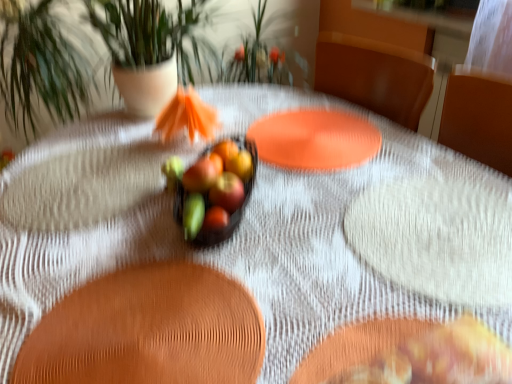
Where is `green leafy plant at center`? green leafy plant at center is located at coordinates (39, 67).

This screenshot has width=512, height=384. Identify the location of golden-brown crispy pastry at lower right. point(439,358).

Locate an element on the screen. green matte apple at center, placed as the 2th fruit when sorted from bottom to top is located at coordinates (173, 172).

Measure the distance between green matte flower at center and camera.

green matte flower at center is 86.08 centimeters away from camera.

Where is `green leafy plant at center`? The image size is (512, 384). green leafy plant at center is located at coordinates (39, 67).

Which object is closer to the camera taking this photo, glossy ceramic grapefruit at center or glossy apple at center, arranged as the first apple when viewed from the back?

Positioned in front is glossy ceramic grapefruit at center.

Which object is wider, glossy ceramic grapefruit at center or glossy apple at center, arranged as the first apple when viewed from the back?

With larger width is glossy ceramic grapefruit at center.

From the image's perspective, which is above, glossy ceramic grapefruit at center or glossy apple at center, arranged as the first apple when viewed from the back?

glossy apple at center, arranged as the first apple when viewed from the back.

Who is bigger, glossy glass bowl at center, which ranks as the third fruit in left-to-right order, or green matte apple at center, the third fruit positioned from the right?

With larger size is glossy glass bowl at center, which ranks as the third fruit in left-to-right order.

Based on the photo, based on their positions, is glossy glass bowl at center, the 3th fruit when ordered from bottom to top, located to the left or right of green matte apple at center, the 2th fruit from the front?

glossy glass bowl at center, the 3th fruit when ordered from bottom to top, is positioned on green matte apple at center, the 2th fruit from the front,'s right side.

From the image's perspective, which object appears higher, glossy glass bowl at center, which ranks as the third fruit in left-to-right order, or green matte apple at center, the third fruit positioned from the right?

glossy glass bowl at center, which ranks as the third fruit in left-to-right order, appears higher in the image.

Find the location of a particular element. fruit that is the 2nd one when counting rightward from the green matte apple at center, placed as the 2th fruit when sorted from bottom to top is located at coordinates (226, 149).

Could you tell me if green matte apple at center, the third fruit positioned from the right, is turned towards glossy apple at center, arranged as the first apple when viewed from the back?

No, green matte apple at center, the third fruit positioned from the right, does not turn towards glossy apple at center, arranged as the first apple when viewed from the back.

Could glossy apple at center, arranged as the second apple when viewed from the front, be considered to be inside green matte apple at center, the third fruit positioned from the right?

No, glossy apple at center, arranged as the second apple when viewed from the front, is located outside of green matte apple at center, the third fruit positioned from the right.

In terms of height, does green matte apple at center, the 1th fruit when ordered from left to right, look taller or shorter compared to glossy apple at center, arranged as the second apple when viewed from the front?

In the image, green matte apple at center, the 1th fruit when ordered from left to right, appears to be shorter than glossy apple at center, arranged as the second apple when viewed from the front.

Relative to glossy apple at center, arranged as the first apple when viewed from the back, is green matte apple at center, which is the second fruit in back-to-front order, in front or behind?

green matte apple at center, which is the second fruit in back-to-front order, is positioned farther from the viewer than glossy apple at center, arranged as the first apple when viewed from the back.

Could green matte flower at center be considered to be inside glossy glass bowl at center, the first fruit from the top?

Actually, green matte flower at center is outside glossy glass bowl at center, the first fruit from the top.

Where is `flower that is below the glossy glass bowl at center, which ranks as the third fruit in left-to-right order (from the image's perspective)`? This screenshot has height=384, width=512. flower that is below the glossy glass bowl at center, which ranks as the third fruit in left-to-right order (from the image's perspective) is located at coordinates (200, 176).

From the image's perspective, is glossy glass bowl at center, the third fruit from the front, on green matte flower at center?

Yes, from the image's perspective, glossy glass bowl at center, the third fruit from the front, is above green matte flower at center.

Does golden-brown crispy pastry at lower right have a lesser width compared to green matte apple at center, acting as the 2th fruit starting from the top?

No.

Does point (456, 349) come in front of point (178, 172)?

Yes.

Does golden-brown crispy pastry at lower right have a smaller size compared to green matte apple at center, the 2th fruit from the front?

No.

From a real-world perspective, starting from the golden-brown crispy pastry at lower right, which fruit is the 2nd one vertically above it? Please provide its 2D coordinates.

[(173, 172)]

Does point (169, 173) come farther from viewer compared to point (206, 233)?

Yes, point (169, 173) is farther from viewer.

Is green matte apple at center, the 1th fruit when ordered from left to right, to the right of glossy ceramic grapefruit at center from the viewer's perspective?

No, green matte apple at center, the 1th fruit when ordered from left to right, is not to the right of glossy ceramic grapefruit at center.

Is glossy ceramic grapefruit at center a part of green matte apple at center, which is the second fruit in back-to-front order?

No, glossy ceramic grapefruit at center is not a part of green matte apple at center, which is the second fruit in back-to-front order.

In the scene shown: Can you confirm if green matte apple at center, the 2th fruit from the front, is taller than glossy ceramic grapefruit at center?

Indeed, green matte apple at center, the 2th fruit from the front, has a greater height compared to glossy ceramic grapefruit at center.

Is glossy ceramic grapefruit at center positioned far away from green matte flower at center?

No, glossy ceramic grapefruit at center is not far from green matte flower at center.

Could you tell me if glossy ceramic grapefruit at center is facing green matte flower at center?

No, glossy ceramic grapefruit at center is not turned towards green matte flower at center.

Can you confirm if glossy ceramic grapefruit at center is positioned to the right of green matte flower at center?

Correct, you'll find glossy ceramic grapefruit at center to the right of green matte flower at center.

Which is farther, [181,210] or [201,170]?

Point [201,170]

The height and width of the screenshot is (384, 512). Find the location of `grapefruit directly beneath the glossy apple at center, arranged as the second apple when viewed from the front (from a real-world perspective)`. grapefruit directly beneath the glossy apple at center, arranged as the second apple when viewed from the front (from a real-world perspective) is located at coordinates tap(239, 208).

Image resolution: width=512 pixels, height=384 pixels. I want to click on the 2nd fruit counting from the left of the glossy glass bowl at center, the first fruit from the top, so click(x=173, y=172).

In the scene shown: Estimate the real-world distances between objects in this image. Which object is further from green matte apple at center, which is the second fruit in back-to-front order, glossy apple at center, arranged as the first apple when viewed from the back, or golden-brown crispy pastry at lower right?

golden-brown crispy pastry at lower right.

Estimate the real-world distances between objects in this image. Which object is closer to green matte flower at center, glossy glass bowl at center, the third fruit from the front, or golden-brown crispy pastry at lower right?

Based on the image, glossy glass bowl at center, the third fruit from the front, appears to be nearer to green matte flower at center.

Looking at the image, which one is located further to green leafy plant at center, glossy apple at center, arranged as the first apple when viewed from the back, or glossy ceramic grapefruit at center?

glossy apple at center, arranged as the first apple when viewed from the back, is positioned further to the anchor green leafy plant at center.

Which object lies nearer to the anchor point glossy red apple at center, the second apple in the back-to-front sequence, green matte flower at center or glossy ceramic grapefruit at center?

green matte flower at center is positioned closer to the anchor glossy red apple at center, the second apple in the back-to-front sequence.

From the image, which object appears to be farther from glossy apple at center, arranged as the second apple when viewed from the front, glossy red apple at center, placed as the third fruit when sorted from back to front, or glossy red apple at center, the second apple in the back-to-front sequence?

glossy red apple at center, placed as the third fruit when sorted from back to front, is positioned further to the anchor glossy apple at center, arranged as the second apple when viewed from the front.

Considering their positions, is glossy ceramic grapefruit at center positioned closer to glossy apple at center, arranged as the first apple when viewed from the back, than glossy red apple at center, the first apple in the front-to-back sequence?

glossy red apple at center, the first apple in the front-to-back sequence, lies closer to glossy apple at center, arranged as the first apple when viewed from the back, than the other object.

From the image, which object appears to be nearer to golden-brown crispy pastry at lower right, glossy red apple at center, the first apple in the front-to-back sequence, or glossy apple at center, arranged as the second apple when viewed from the front?

glossy red apple at center, the first apple in the front-to-back sequence, is closer to golden-brown crispy pastry at lower right.

Estimate the real-world distances between objects in this image. Which object is further from glossy apple at center, arranged as the first apple when viewed from the back, green matte flower at center or green leafy plant at center?

green leafy plant at center.

Find the location of a particular element. The height and width of the screenshot is (384, 512). apple between green leafy plant at center and green matte flower at center vertically is located at coordinates (240, 164).

Identify the location of apple between golden-brown crispy pastry at lower right and glossy apple at center, arranged as the first apple when viewed from the back, in the front-back direction. (227, 192).

The width and height of the screenshot is (512, 384). In order to click on flower between green leafy plant at center and glossy red apple at center, which is the second fruit from left to right, in the up-down direction in this screenshot , I will do `click(200, 176)`.

Locate an element on the screen. flower located between glossy red apple at center, which is counted as the 1th fruit, starting from the front, and glossy glass bowl at center, the third fruit from the front, in the depth direction is located at coordinates (200, 176).